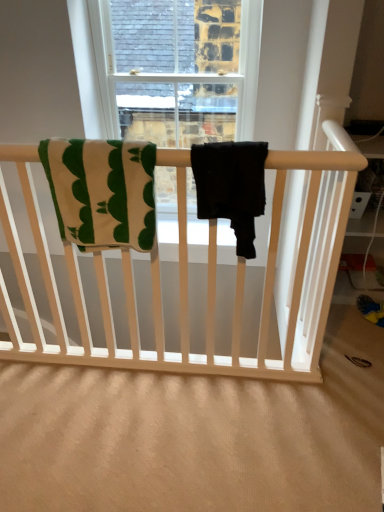
Question: Would you say green striped towel at upper left, which appears as the 1th beach towel when viewed from the left, is to the left or to the right of black matte pants at center, which is the second beach towel from left to right, in the picture?

Choices:
 (A) left
 (B) right

Answer: (A)

Question: Is green striped towel at upper left, which appears as the 1th beach towel when viewed from the left, wider or thinner than black matte pants at center, the first beach towel from the right?

Choices:
 (A) wide
 (B) thin

Answer: (B)

Question: From their relative heights in the image, would you say green striped towel at upper left, the second beach towel positioned from the right, is taller or shorter than black matte pants at center, the first beach towel from the right?

Choices:
 (A) tall
 (B) short

Answer: (A)

Question: Is black matte pants at center, the first beach towel from the right, wider or thinner than green striped towel at upper left, the second beach towel positioned from the right?

Choices:
 (A) thin
 (B) wide

Answer: (B)

Question: From the image's perspective, relative to green striped towel at upper left, which appears as the 1th beach towel when viewed from the left, is black matte pants at center, the first beach towel from the right, above or below?

Choices:
 (A) below
 (B) above

Answer: (A)

Question: From a real-world perspective, is black matte pants at center, which is the second beach towel from left to right, above or below green striped towel at upper left, which appears as the 1th beach towel when viewed from the left?

Choices:
 (A) below
 (B) above

Answer: (B)

Question: Is black matte pants at center, which is the second beach towel from left to right, inside the boundaries of green striped towel at upper left, the second beach towel positioned from the right, or outside?

Choices:
 (A) inside
 (B) outside

Answer: (B)